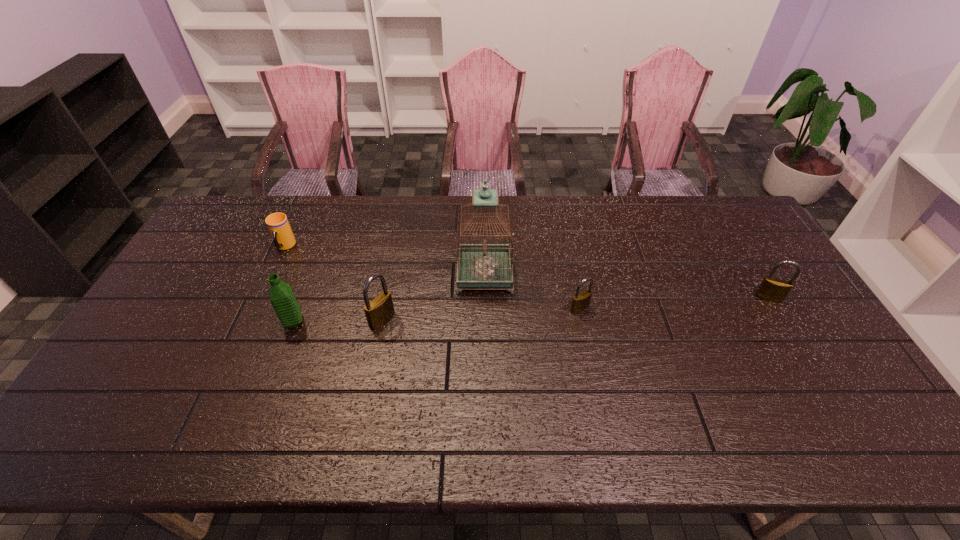
Find the location of a particular element. Image resolution: width=960 pixels, height=540 pixels. unoccupied position between the tallest object and the rightmost object is located at coordinates (626, 286).

The image size is (960, 540). I want to click on free space between the third object from right to left and the second padlock from right to left, so click(x=532, y=291).

Locate which object is the third closest to the third object from left to right. Please provide its 2D coordinates. Your answer should be formatted as a tuple, i.e. [(x, y)], where the tuple contains the x and y coordinates of a point satisfying the conditions above.

[(277, 223)]

Where is `object that stands as the second closest to the fourth object from right to left`? This screenshot has width=960, height=540. object that stands as the second closest to the fourth object from right to left is located at coordinates (281, 296).

Identify which padlock is the second closest to the fifth object from right to left. Please provide its 2D coordinates. Your answer should be formatted as a tuple, i.e. [(x, y)], where the tuple contains the x and y coordinates of a point satisfying the conditions above.

[(580, 301)]

Identify which padlock is the third closest to the cup. Please provide its 2D coordinates. Your answer should be formatted as a tuple, i.e. [(x, y)], where the tuple contains the x and y coordinates of a point satisfying the conditions above.

[(772, 289)]

Locate an element on the screen. This screenshot has height=540, width=960. free spot that satisfies the following two spatial constraints: 1. on the side of the water bottle with the handle; 2. on the left side of the cup is located at coordinates (251, 322).

The width and height of the screenshot is (960, 540). I want to click on vacant position in the image that satisfies the following two spatial constraints: 1. on the back side of the third object from left to right; 2. on the right side of the third shortest object, so click(x=386, y=298).

Locate an element on the screen. vacant space that satisfies the following two spatial constraints: 1. on the side of the leftmost object with the handle; 2. on the left side of the leftmost padlock is located at coordinates (252, 320).

You are a GUI agent. You are given a task and a screenshot of the screen. Output one action in this format:
    pyautogui.click(x=<x>, y=<y>)
    Task: Click on the vacant area in the image that satisfies the following two spatial constraints: 1. on the back side of the second tallest padlock; 2. on the right side of the water bottle
    This screenshot has width=960, height=540.
    Given the screenshot: What is the action you would take?
    pyautogui.click(x=302, y=298)